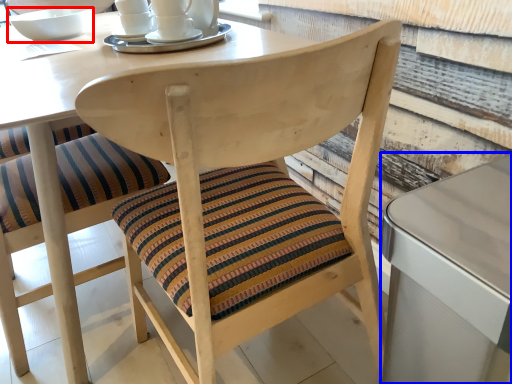
Question: Which object appears farthest to the camera in this image, bowl (highlighted by a red box) or table (highlighted by a blue box)?

Choices:
 (A) bowl
 (B) table

Answer: (A)